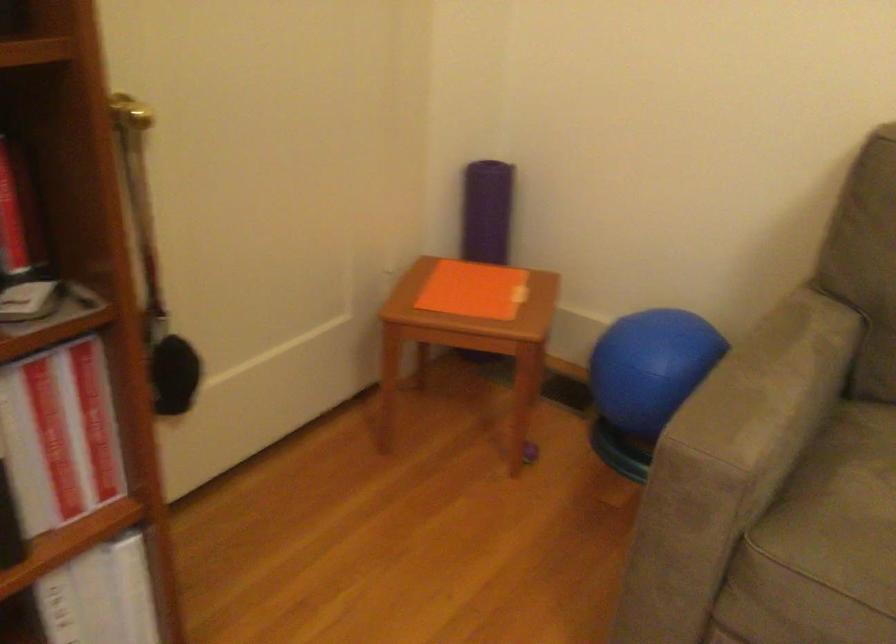
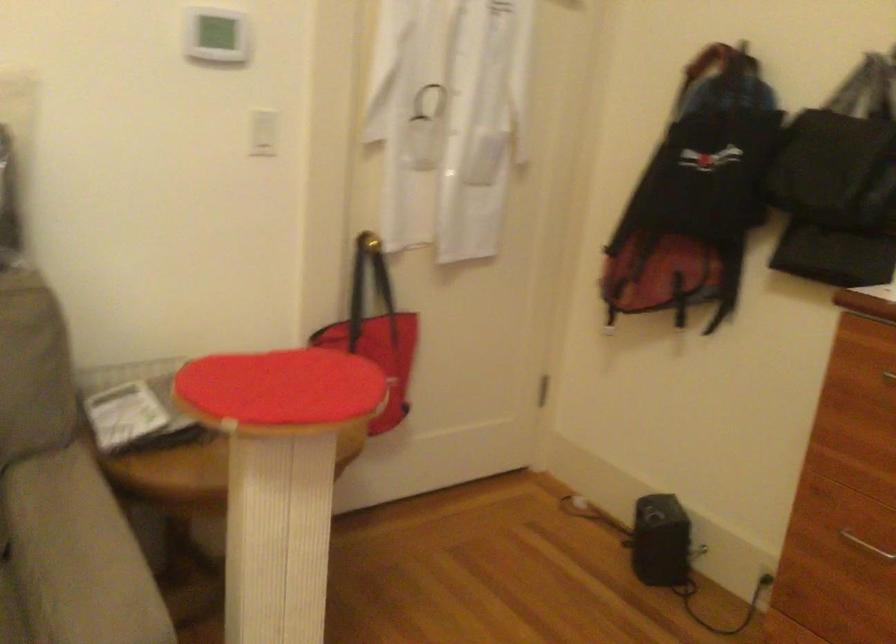
Question: How did the camera likely rotate?

Choices:
 (A) Left
 (B) Right
 (C) Up
 (D) Down

Answer: (B)